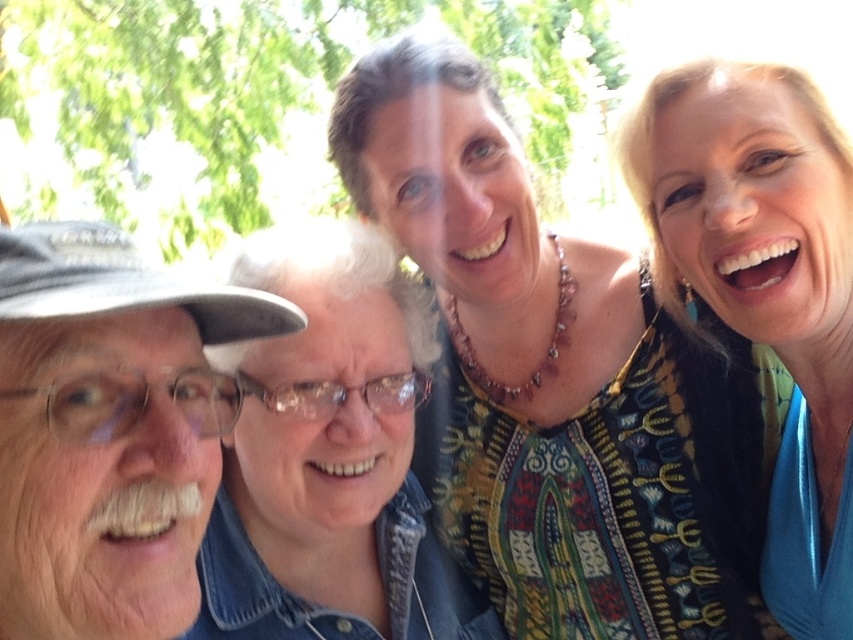
Is white matte cap at left behind blonde hair at upper right?

That is False.

Describe the element at coordinates (108, 429) in the screenshot. The width and height of the screenshot is (853, 640). I see `white matte cap at left` at that location.

Find the location of `white matte cap at left`. white matte cap at left is located at coordinates (108, 429).

Is multicolored fabric top at center bigger than blonde hair at upper right?

Indeed, multicolored fabric top at center has a larger size compared to blonde hair at upper right.

How much distance is there between multicolored fabric top at center and blonde hair at upper right?

They are 24.78 centimeters apart.

Does point (728, 465) come closer to viewer compared to point (757, 97)?

No, it is behind (757, 97).

At what (x,y) coordinates should I click in order to perform the action: click on multicolored fabric top at center. Please return your answer as a coordinate pair (x, y). The image size is (853, 640). Looking at the image, I should click on (560, 380).

Which is below, multicolored fabric top at center or white matte cap at left?

Positioned lower is white matte cap at left.

Can you confirm if multicolored fabric top at center is taller than white matte cap at left?

Yes, multicolored fabric top at center is taller than white matte cap at left.

Which is in front, point (521, 337) or point (67, 456)?

Point (67, 456)

In order to click on multicolored fabric top at center in this screenshot , I will do `click(560, 380)`.